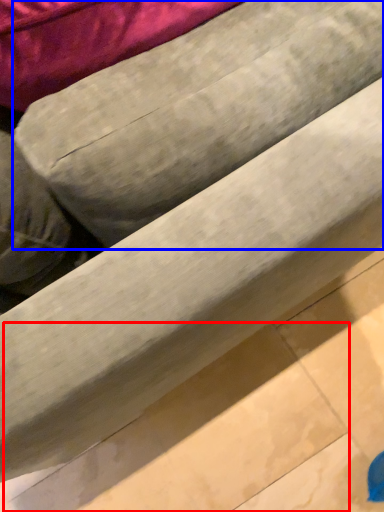
Question: Which point is closer to the camera, tile (highlighted by a red box) or bean bag chair (highlighted by a blue box)?

Choices:
 (A) tile
 (B) bean bag chair

Answer: (B)